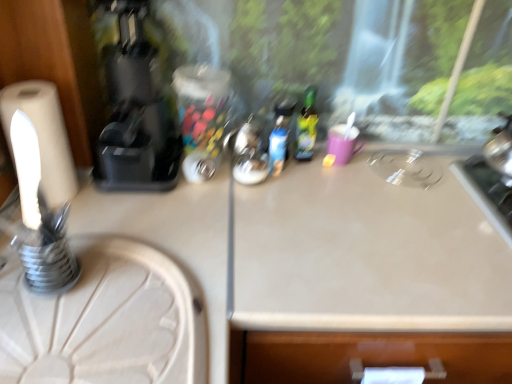
This screenshot has width=512, height=384. I want to click on vacant area located to the right-hand side of matte plastic bottle at center, which is the 1th bottle from left to right, so click(x=320, y=171).